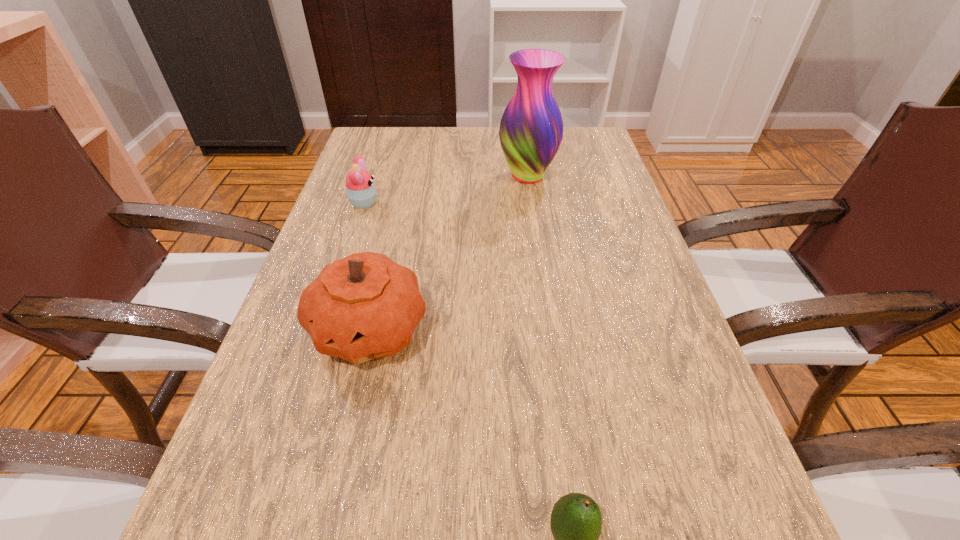
The image size is (960, 540). I want to click on vase, so click(531, 129).

The height and width of the screenshot is (540, 960). I want to click on the third shortest object, so click(x=365, y=306).

You are a GUI agent. You are given a task and a screenshot of the screen. Output one action in this format:
    pyautogui.click(x=<x>, y=<y>)
    Task: Click on the pumpkin
    
    Given the screenshot: What is the action you would take?
    tap(365, 306)

I want to click on the second shortest object, so click(x=361, y=192).

The height and width of the screenshot is (540, 960). Identify the location of free space located 0.060m on the left of the vase. (x=475, y=176).

Locate an element on the screen. The width and height of the screenshot is (960, 540). vacant space located on the front-facing side of the pumpkin is located at coordinates (332, 494).

I want to click on free space located 0.380m on the face of the third tallest object, so click(531, 204).

Where is `object situated at the far edge`? The width and height of the screenshot is (960, 540). object situated at the far edge is located at coordinates (531, 129).

I want to click on pumpkin that is at the left edge, so click(x=365, y=306).

Image resolution: width=960 pixels, height=540 pixels. Identify the location of cupcake at the left edge. tap(361, 192).